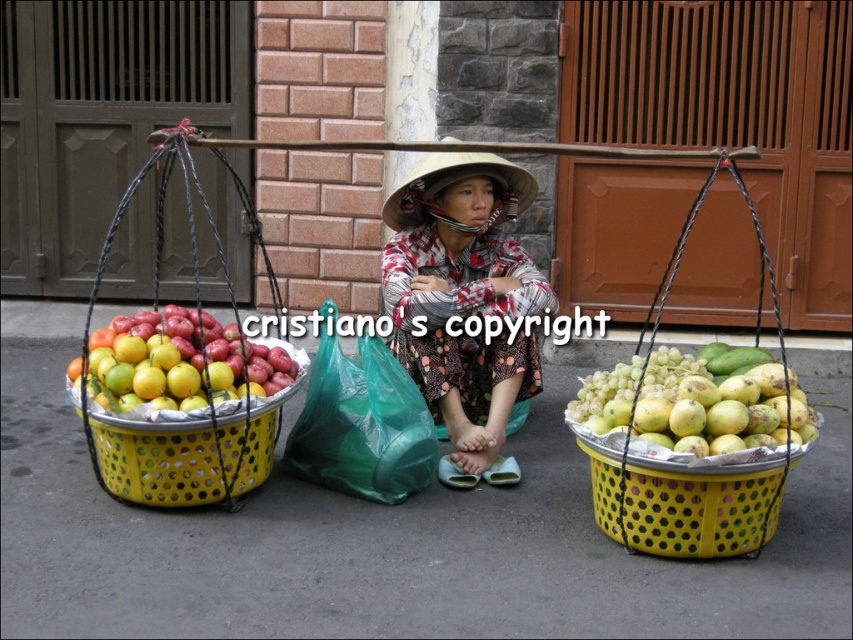
You are a customer at the market and want to buy the green matte grapes at right and the green plastic bag at center. Which one is closer to you if you are standing in front of the baskets?

The green matte grapes at right is in front of the green plastic bag at center, so the grapes are closer to you.

You are a fruit vendor who needs to find the shiny metallic apples at left in the image. Where exactly are they located in terms of coordinates?

The shiny metallic apples at left are located at coordinates point (x=177, y=364).

You are a delivery person standing at the point with coordinates point (758, 248) and need to deliver a package to the point with coordinates point (730, 440). Based on the scene description, is the destination point visible from your current position?

Yes, because point (730, 440) is in front of point (758, 248), so the destination point is visible from the current position.